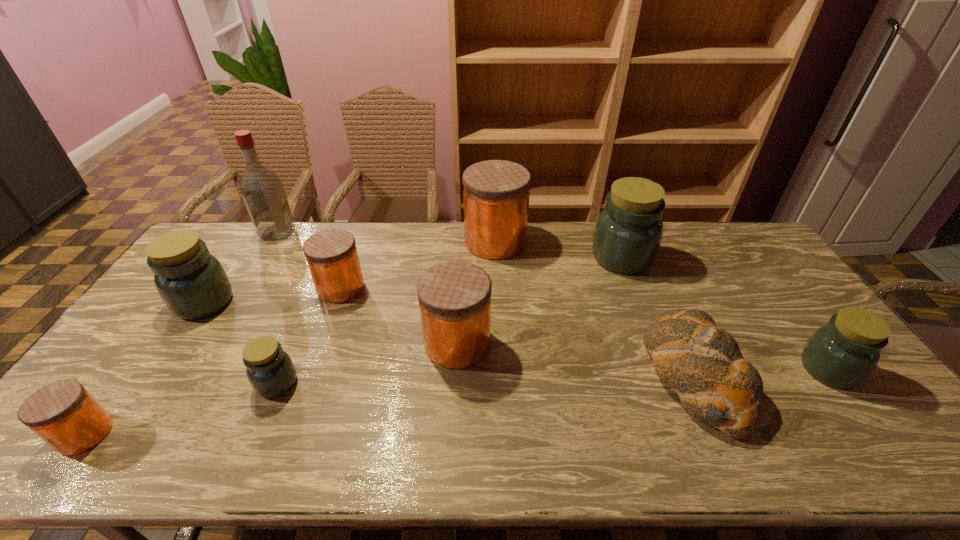
Where is `liquor`? liquor is located at coordinates (262, 190).

Where is `the farthest green jar`? Image resolution: width=960 pixels, height=540 pixels. the farthest green jar is located at coordinates (628, 232).

Locate an element on the screen. The width and height of the screenshot is (960, 540). the seventh jar from left to right is located at coordinates (628, 232).

Locate an element on the screen. This screenshot has height=540, width=960. the biggest orange jar is located at coordinates (496, 193).

Image resolution: width=960 pixels, height=540 pixels. What are the coordinates of `the second nearest orange jar` in the screenshot? It's located at (454, 297).

In order to click on the third nearest green jar in this screenshot , I will do `click(193, 284)`.

At what (x,y) coordinates should I click in order to perform the action: click on the leftmost green jar. Please return your answer as a coordinate pair (x, y). This screenshot has width=960, height=540. Looking at the image, I should click on (193, 284).

Where is `the third biggest orange jar`? The height and width of the screenshot is (540, 960). the third biggest orange jar is located at coordinates (332, 257).

What are the coordinates of `the second farthest orange jar` in the screenshot? It's located at (332, 257).

Find the location of a particular element. This screenshot has width=960, height=540. the rightmost jar is located at coordinates 843,353.